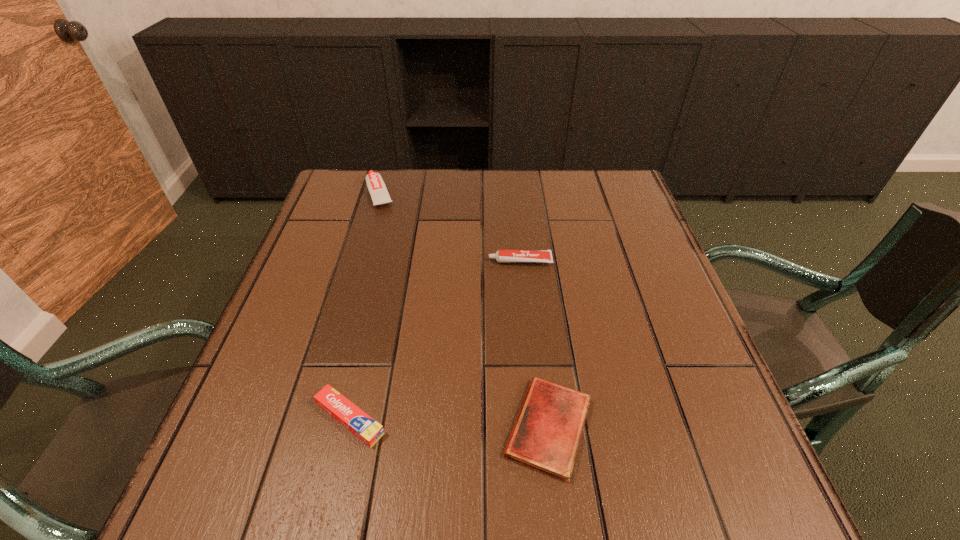
Locate an element on the screen. Image resolution: width=960 pixels, height=540 pixels. vacant area at the near left corner of the desktop is located at coordinates (257, 504).

Locate an element on the screen. The width and height of the screenshot is (960, 540). free region at the far right corner of the desktop is located at coordinates (576, 181).

Identify the location of vacant area between the farthest object and the rightmost toothpaste. (450, 227).

I want to click on vacant point located between the tallest object and the diary, so click(465, 310).

Locate an element on the screen. This screenshot has width=960, height=540. free space between the second tallest toothpaste and the shortest object is located at coordinates (535, 344).

You are a GUI agent. You are given a task and a screenshot of the screen. Output one action in this format:
    pyautogui.click(x=<x>, y=<y>)
    Task: Click on the vacant point located between the shortest toothpaste and the second tallest object
    The image size is (960, 540).
    Given the screenshot: What is the action you would take?
    pyautogui.click(x=435, y=340)

In order to click on vacant space that's between the shortest toothpaste and the shortest object in this screenshot , I will do `click(449, 423)`.

Locate an element on the screen. vacant area that lies between the rightmost toothpaste and the second shortest object is located at coordinates (435, 340).

Locate an element on the screen. The width and height of the screenshot is (960, 540). free point between the second shortest object and the second tallest object is located at coordinates (435, 340).

Image resolution: width=960 pixels, height=540 pixels. Identify the location of free spot between the shortest toothpaste and the diary. (449, 423).